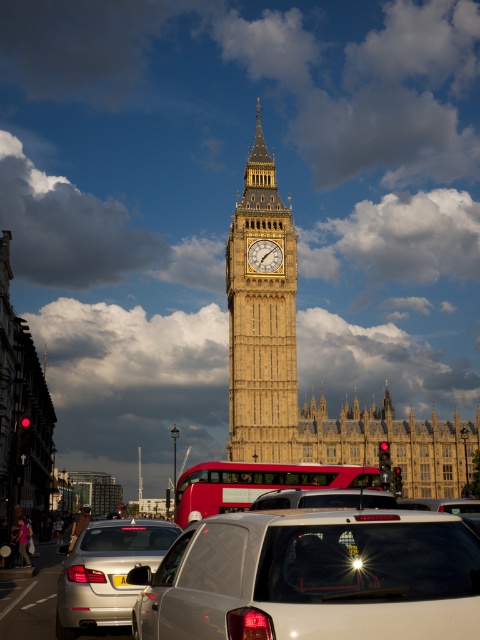
Can you confirm if red rubber double-decker bus at center is positioned to the right of gold textured clock at center?

No, red rubber double-decker bus at center is not to the right of gold textured clock at center.

Who is positioned more to the left, red rubber double-decker bus at center or gold textured clock at center?

red rubber double-decker bus at center is more to the left.

This screenshot has width=480, height=640. What do you see at coordinates (257, 483) in the screenshot?
I see `red rubber double-decker bus at center` at bounding box center [257, 483].

Locate an element on the screen. The width and height of the screenshot is (480, 640). red rubber double-decker bus at center is located at coordinates (257, 483).

Describe the element at coordinates (264, 256) in the screenshot. The image size is (480, 640). I see `gold textured clock at center` at that location.

At what (x,y) coordinates should I click in order to perform the action: click on gold textured clock at center. Please return your answer as a coordinate pair (x, y). The height and width of the screenshot is (640, 480). Looking at the image, I should click on (264, 256).

Consider the image. Who is more distant from viewer, (259, 252) or (117, 577)?

The point (259, 252) is behind.

Find the location of `gold textured clock at center`. gold textured clock at center is located at coordinates (264, 256).

Does golden stone clock tower at center have a smaller size compared to red rubber double-decker bus at center?

No.

Locate an element on the screen. This screenshot has width=480, height=640. golden stone clock tower at center is located at coordinates (262, 316).